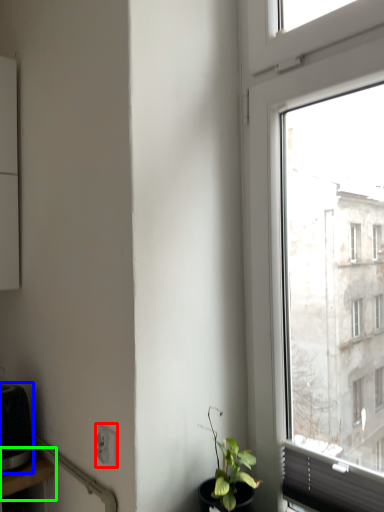
Question: Considering the real-world distances, which object is farthest from power plugs and sockets (highlighted by a red box)? appliance (highlighted by a blue box) or table (highlighted by a green box)?

Choices:
 (A) appliance
 (B) table

Answer: (A)